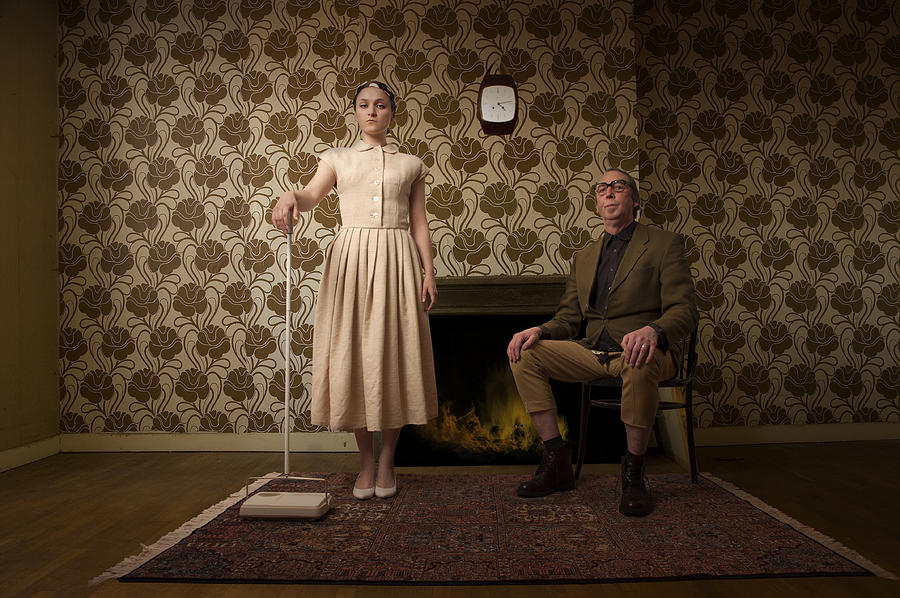
This screenshot has height=598, width=900. I want to click on vertical watch shaped clock, so click(x=500, y=127).